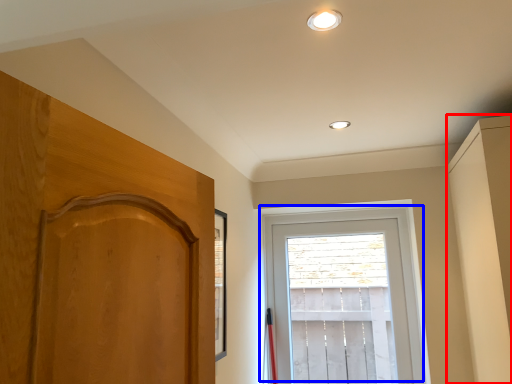
Question: Among these objects, which one is nearest to the camera, dresser (highlighted by a red box) or window (highlighted by a blue box)?

Choices:
 (A) dresser
 (B) window

Answer: (A)